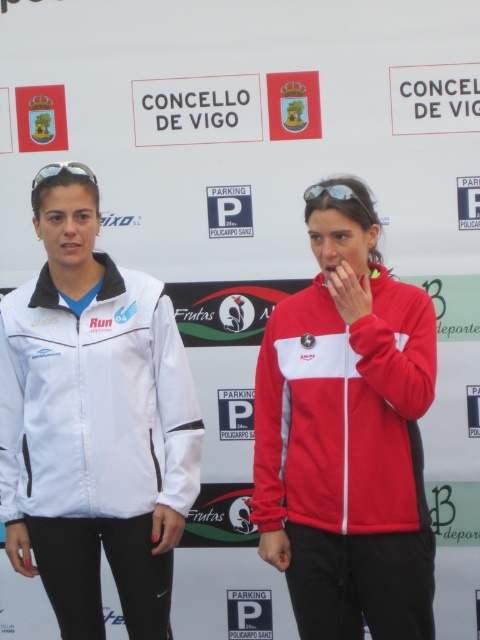
Question: Which is nearer to the red fleece jacket at center?

Choices:
 (A) matte black goggles at upper left
 (B) white softshell jacket at left

Answer: (B)

Question: Which point is farther to the camera?

Choices:
 (A) matte black sunglasses at center
 (B) red fleece jacket at center

Answer: (A)

Question: In this image, where is red fleece jacket at center located relative to matte black goggles at upper left?

Choices:
 (A) right
 (B) left

Answer: (A)

Question: Among these points, which one is farthest from the camera?

Choices:
 (A) (48, 177)
 (B) (336, 480)

Answer: (A)

Question: Is red fleece jacket at center in front of matte black sunglasses at center?

Choices:
 (A) no
 (B) yes

Answer: (B)

Question: Is white softshell jacket at left smaller than red fleece jacket at center?

Choices:
 (A) yes
 (B) no

Answer: (A)